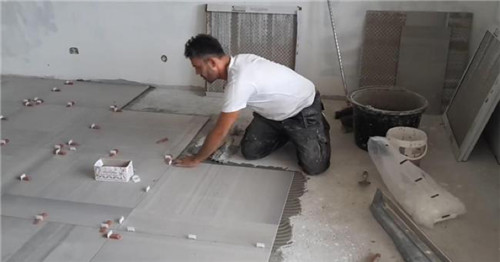
Identify the location of tile spacer. (99, 225).